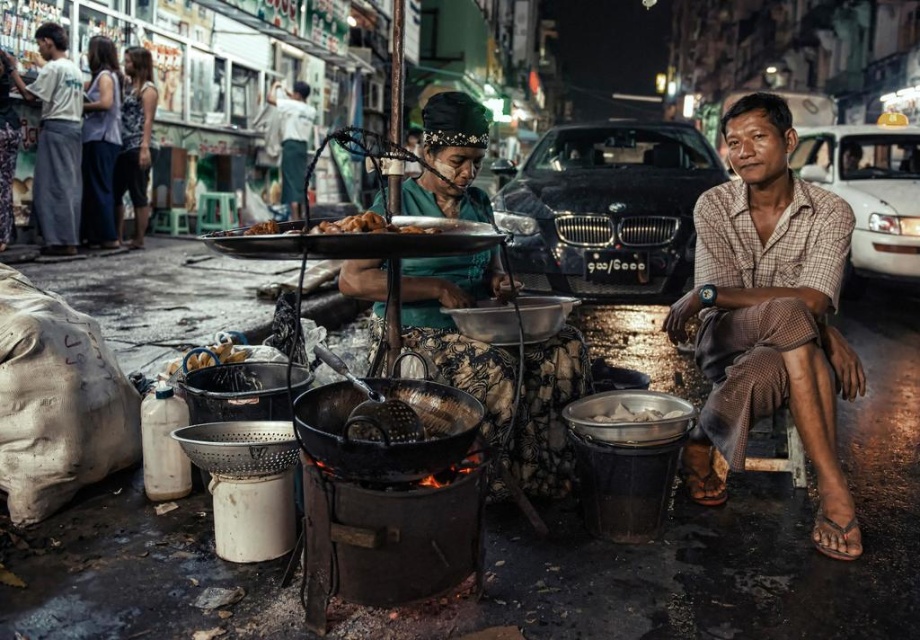
Question: Does white glossy van at upper right come behind golden crispy fried chicken at center?

Choices:
 (A) no
 (B) yes

Answer: (B)

Question: Which point is farther to the camera?

Choices:
 (A) (895, 129)
 (B) (550, 212)
 (C) (424, 232)

Answer: (A)

Question: Is green fabric skirt at center behind black metallic car at center?

Choices:
 (A) no
 (B) yes

Answer: (A)

Question: Which point is closer to the camera taking this photo?

Choices:
 (A) (664, 138)
 (B) (433, 192)

Answer: (B)

Question: Among these objects, which one is nearest to the camera?

Choices:
 (A) green fabric skirt at center
 (B) black metallic car at center

Answer: (A)

Question: Can you confirm if brown checkered shirt at right is bigger than brown crispy fried chicken at center?

Choices:
 (A) no
 (B) yes

Answer: (B)